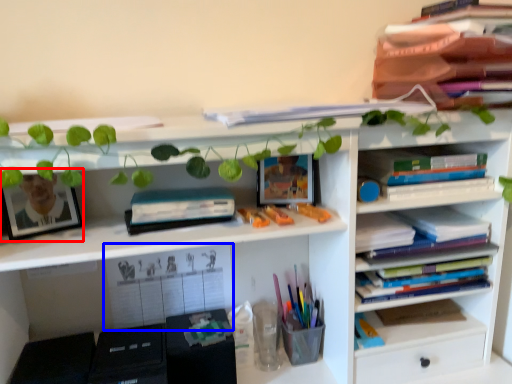
Question: Which object is closer to the camera taking this photo, picture frame (highlighted by a red box) or book (highlighted by a blue box)?

Choices:
 (A) picture frame
 (B) book

Answer: (A)